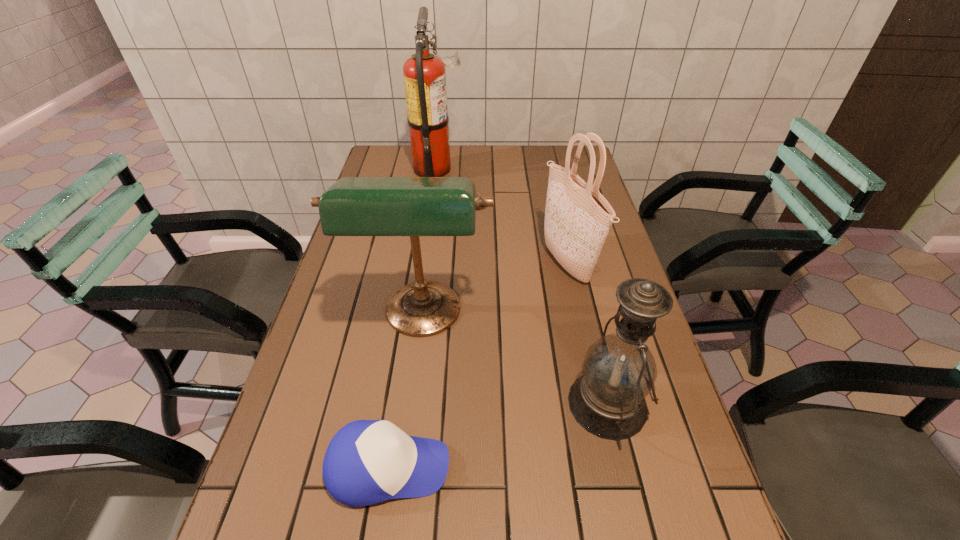
This screenshot has width=960, height=540. I want to click on free space that satisfies the following two spatial constraints: 1. on the back side of the shopping bag; 2. from the nozzle of the farthest object, so click(546, 169).

This screenshot has width=960, height=540. What are the coordinates of `blank space that satisfies the following two spatial constraints: 1. above the green lampshade of the table lamp; 2. on the right side of the oil lamp` in the screenshot? It's located at (411, 404).

At what (x,y) coordinates should I click in order to perform the action: click on free space that satisfies the following two spatial constraints: 1. on the front side of the oil lamp; 2. on the left side of the shopping bag. Please return your answer as a coordinate pair (x, y). Looking at the image, I should click on (598, 404).